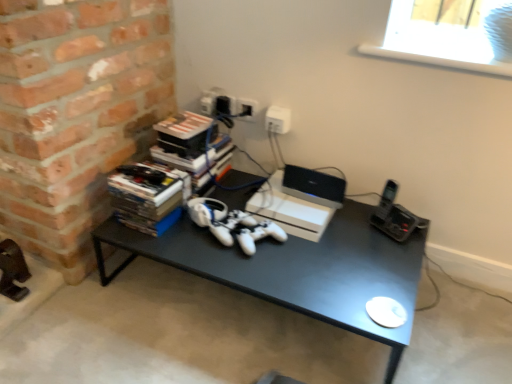
Locate an element on the screen. vacant area that is in front of white plastic laptop at center is located at coordinates (308, 211).